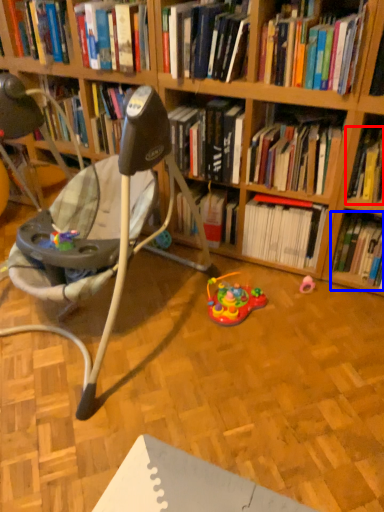
Question: Which object is further to the camera taking this photo, book (highlighted by a red box) or book (highlighted by a blue box)?

Choices:
 (A) book
 (B) book

Answer: (B)